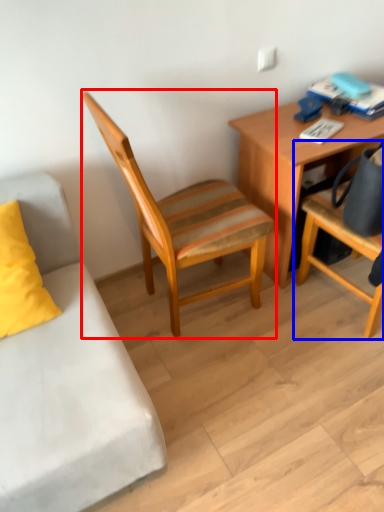
Question: Which point is closer to the camera, chair (highlighted by a red box) or chair (highlighted by a blue box)?

Choices:
 (A) chair
 (B) chair

Answer: (B)